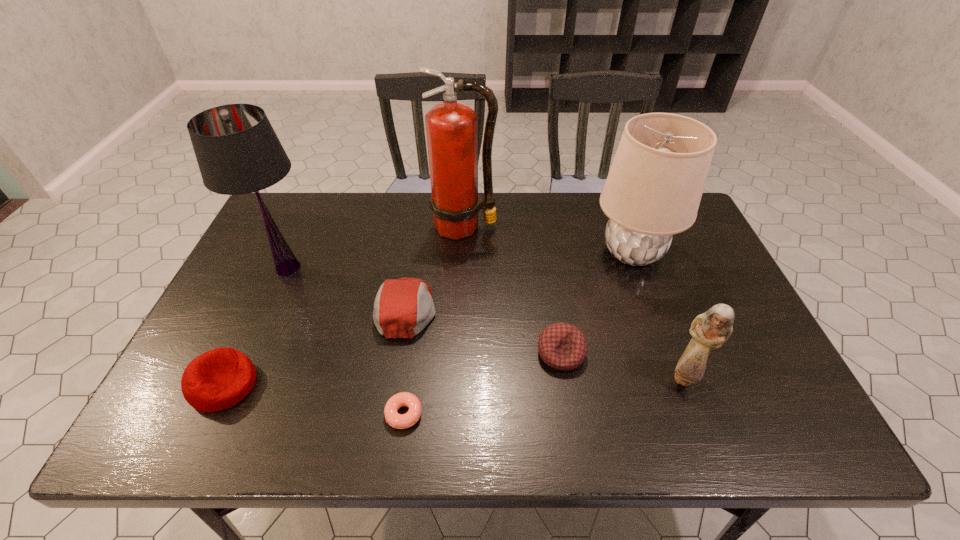
Locate an element on the screen. fire extinguisher is located at coordinates (451, 128).

The width and height of the screenshot is (960, 540). Find the location of `the left lampshade`. the left lampshade is located at coordinates click(238, 152).

Image resolution: width=960 pixels, height=540 pixels. Find the location of `the third tallest object`. the third tallest object is located at coordinates (653, 190).

The height and width of the screenshot is (540, 960). Find the location of `the right lampshade`. the right lampshade is located at coordinates (653, 190).

The height and width of the screenshot is (540, 960). What are the coordinates of `figurine` in the screenshot? It's located at (710, 330).

Find the location of a particular element. cap is located at coordinates (403, 307).

Image resolution: width=960 pixels, height=540 pixels. Find the location of `the left beanbag`. the left beanbag is located at coordinates (218, 379).

At what (x,y) coordinates should I click in order to perform the action: click on the third object from right to left. Please return your answer as a coordinate pair (x, y). Looking at the image, I should click on (562, 346).

Where is `the second shortest object`? This screenshot has width=960, height=540. the second shortest object is located at coordinates click(x=562, y=346).

The width and height of the screenshot is (960, 540). In order to click on doughnut in this screenshot , I will do `click(399, 421)`.